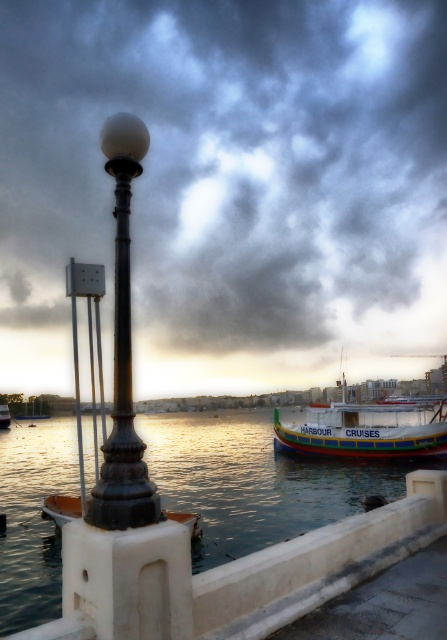
Can you confirm if matte black lamp post at center is positioned to the left of white wooden boat at center?

Yes, matte black lamp post at center is to the left of white wooden boat at center.

Does matte black lamp post at center have a greater width compared to white wooden boat at center?

Correct, the width of matte black lamp post at center exceeds that of white wooden boat at center.

Locate an element on the screen. The image size is (447, 640). matte black lamp post at center is located at coordinates (233, 168).

Between matte black lamp post at center and black polished metal lamp post at left, which one appears on the right side from the viewer's perspective?

Positioned to the right is black polished metal lamp post at left.

Is matte black lamp post at center wider than black polished metal lamp post at left?

Yes, matte black lamp post at center is wider than black polished metal lamp post at left.

Which is in front, point (426, 122) or point (122, 225)?

Point (122, 225)

This screenshot has height=640, width=447. Find the location of `matte black lamp post at center`. matte black lamp post at center is located at coordinates (233, 168).

Can you confirm if clear water at lower center is positioned to the left of white wooden boat at center?

Indeed, clear water at lower center is positioned on the left side of white wooden boat at center.

Can you confirm if clear water at lower center is bigger than white wooden boat at center?

Actually, clear water at lower center might be smaller than white wooden boat at center.

Image resolution: width=447 pixels, height=640 pixels. In order to click on clear water at lower center in this screenshot , I will do `click(252, 481)`.

This screenshot has height=640, width=447. Find the location of `clear water at lower center`. clear water at lower center is located at coordinates (252, 481).